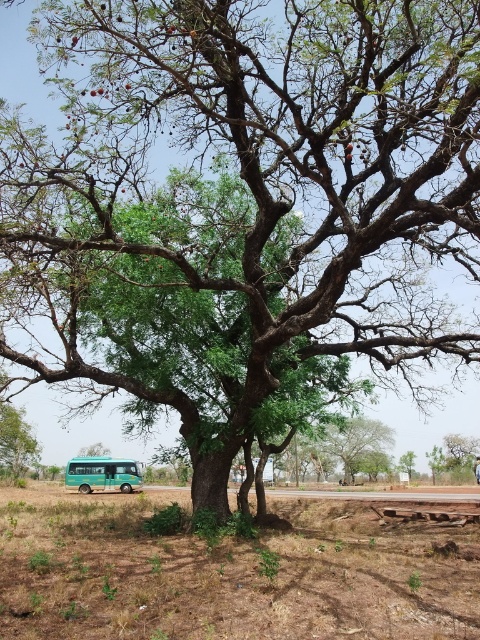
You are a delivery person trying to park your truck next to the green matte bus at lower left and the green leafy tree at center. Which object should you avoid to prevent blocking the road?

You should avoid parking near the green matte bus at lower left because it is larger in size than the green leafy tree at center, so it occupies more space and could block the road more easily.

You are a bird looking for a nesting spot. You see the green leafy tree at lower left and the green leafy tree at center. Which tree is taller and would provide a better vantage point?

The green leafy tree at lower left is taller than the green leafy tree at center, so it would provide a better vantage point.

You are standing at the base of the large tree and want to walk to the green matte bus at lower left. According to the coordinates provided, in which direction should you head relative to the tree?

The green matte bus at lower left is located at coordinates point (103, 474), so you should head towards the lower left direction relative to the tree.